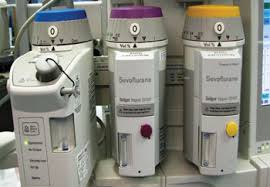
The image size is (270, 187). Identify the location of light. coord(25,143).